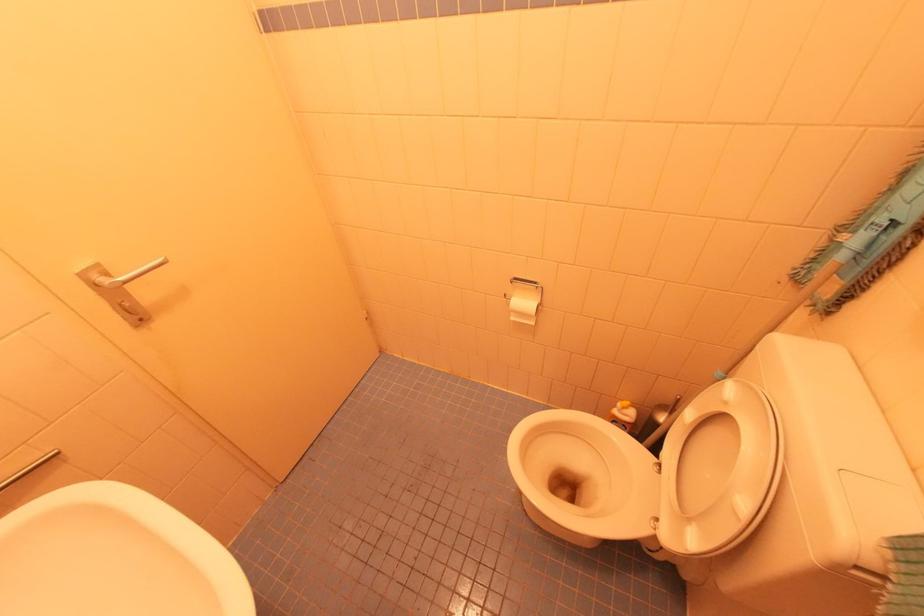
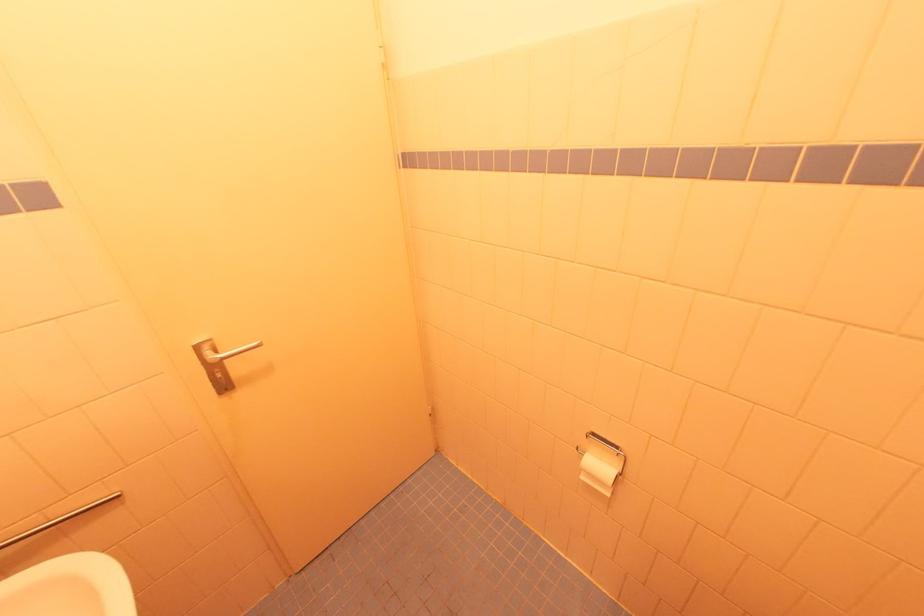
In the second image, find the point that corresponds to point (57, 453) in the first image.

(120, 495)